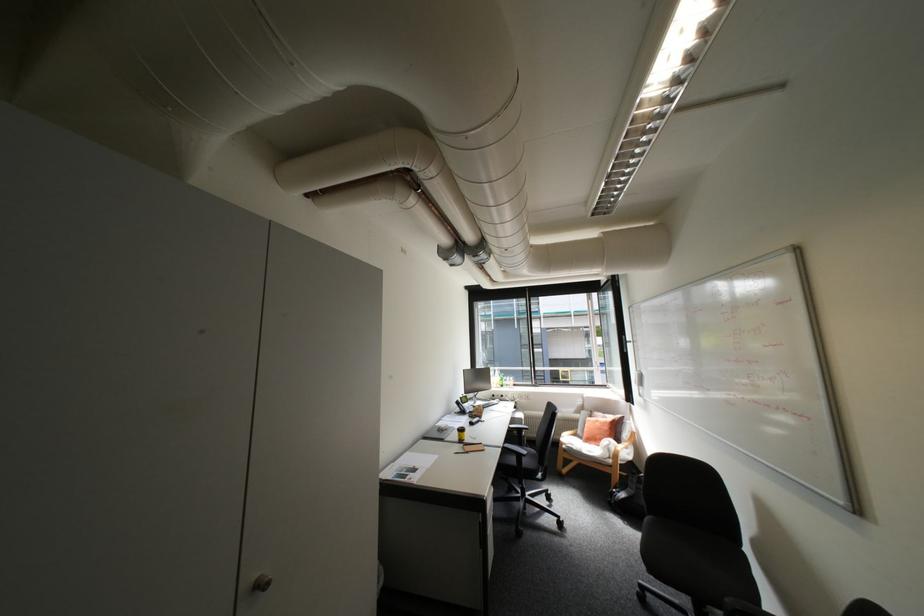
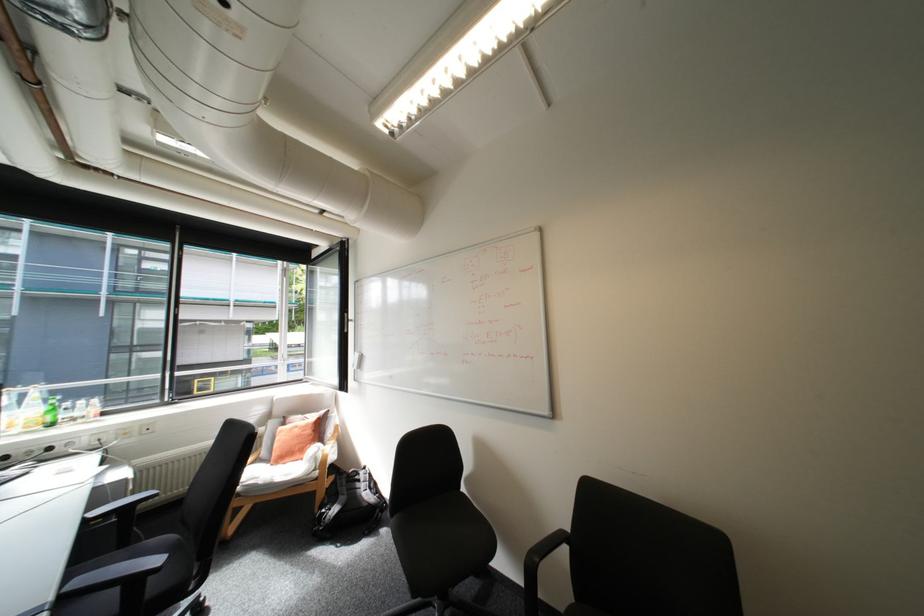
Question: I am providing you with two images of the same scene from different viewpoints. Which of the following objects are not visible in image2?

Choices:
 (A) whiteboard eraser
 (B) black chair armrest
 (C) clear plastic bottle
 (D) none of these

Answer: (D)